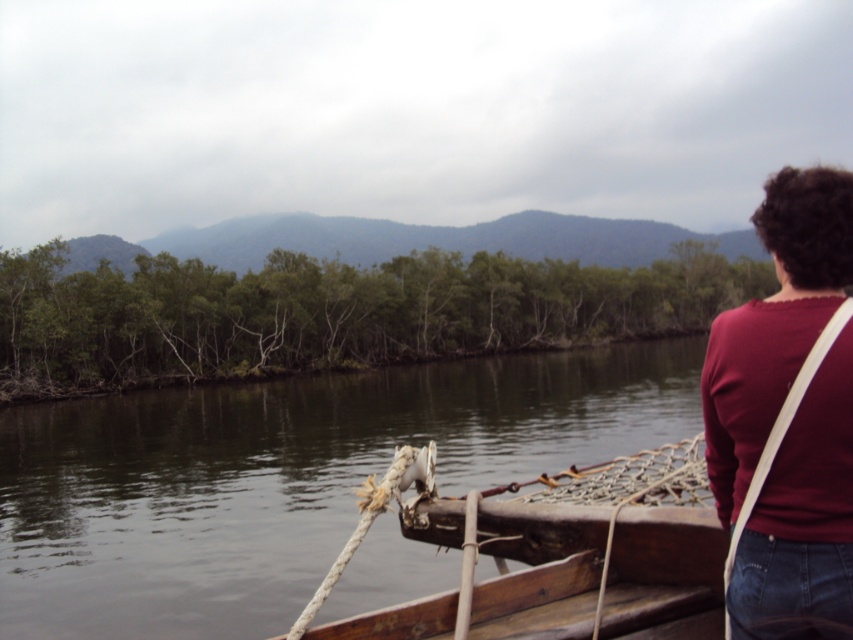
You are a photographer on the wooden boat at center and want to take a picture of the maroon fabric shirt at upper right. Is the shirt positioned above or below the boat?

The maroon fabric shirt at upper right is above the wooden boat at center, so it is positioned above the boat.

You are navigating a wooden boat on a river. Your current position is at coordinates 0.747, 0.334. The brown wooden boat at center is your destination. Can you reach it directly from your current position without any obstacles?

The brown wooden boat at center is located at coordinates (283, 477), which matches your current position. This means you are already at the destination.